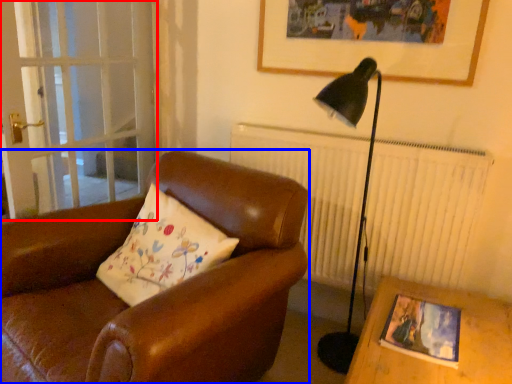
Question: Which point is closer to the camera, screen door (highlighted by a red box) or chair (highlighted by a blue box)?

Choices:
 (A) screen door
 (B) chair

Answer: (B)